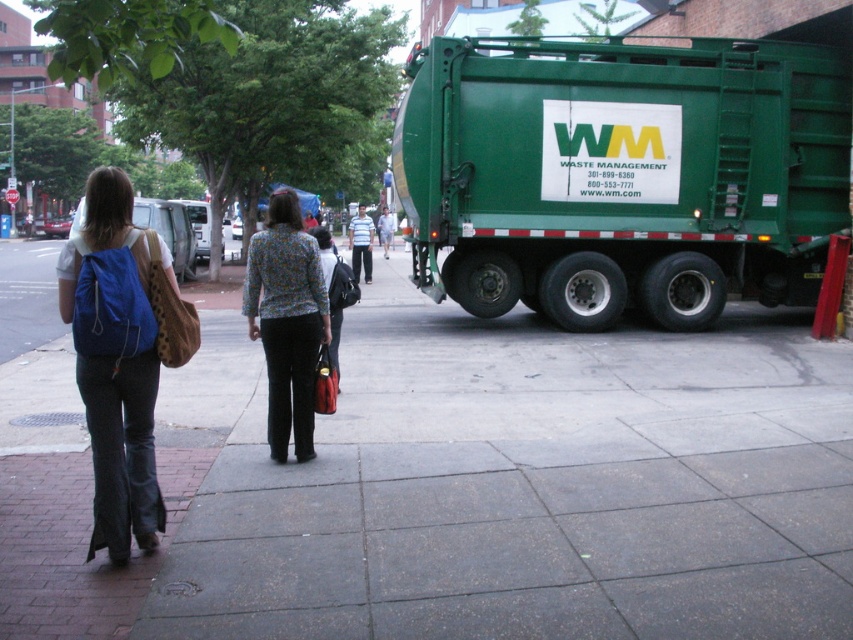
You are a delivery person trying to navigate through the street. You see the green matte truck at right and the striped cotton shirt at center. Which object is positioned lower in the image?

The green matte truck at right is positioned lower than the striped cotton shirt at center in the image.

Consider the image. You are a delivery person trying to pass by the green matte truck at right and the striped cotton shirt at center. Since you need to know which one is narrower to choose the best path, can you tell me which object is thinner?

The green matte truck at right is thinner than striped cotton shirt at center, so you should choose the path near the green matte truck at right as it is narrower.